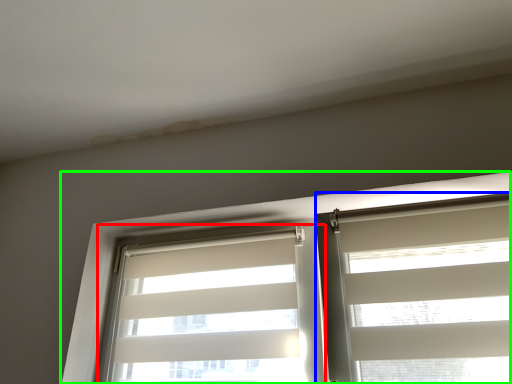
Question: Which is farther away from window blind (highlighted by a red box)? window blind (highlighted by a blue box) or window (highlighted by a green box)?

Choices:
 (A) window blind
 (B) window

Answer: (A)